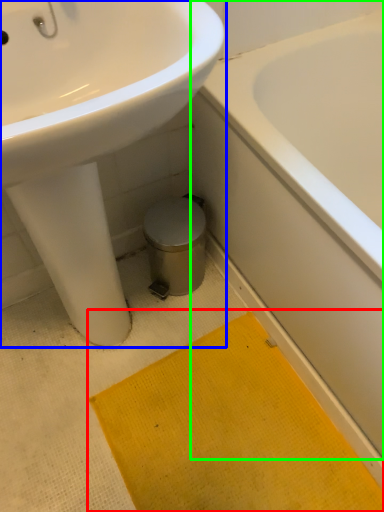
Question: Which object is positioned farthest from bath mat (highlighted by a red box)? Select from sink (highlighted by a blue box) and bathtub (highlighted by a green box).

Choices:
 (A) sink
 (B) bathtub

Answer: (A)